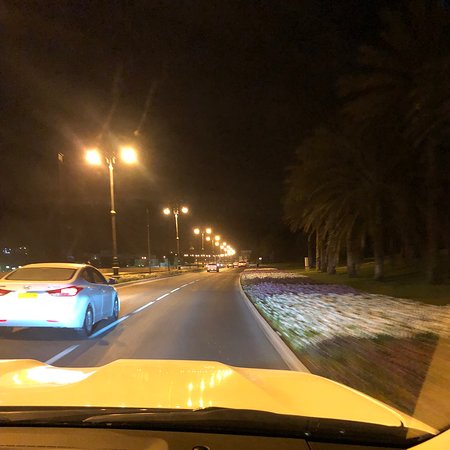
The image size is (450, 450). What are the coordinates of `lights` in the screenshot? It's located at coord(96,157), coord(134,152).